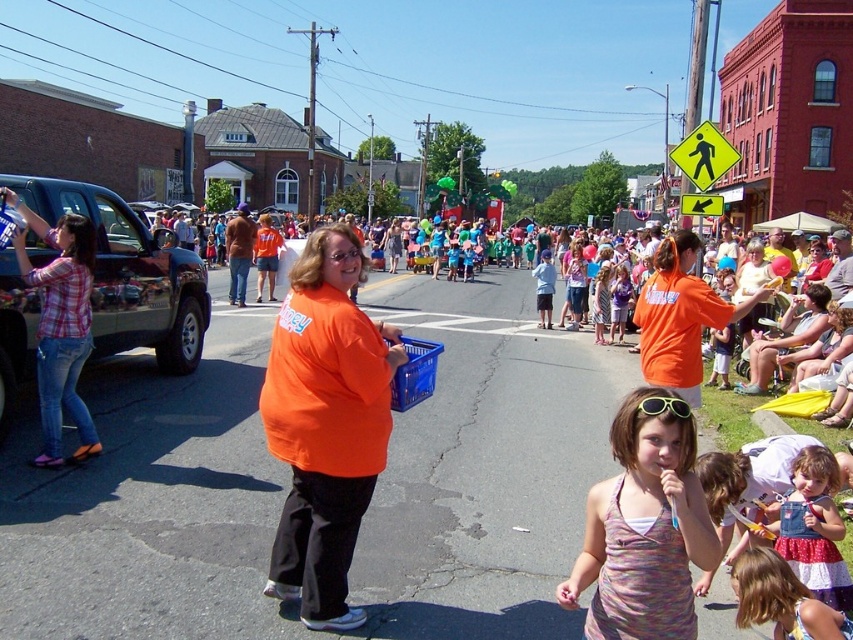
Who is lower down, orange fabric shirt at center or sunglasses at center?

orange fabric shirt at center

Between point (347, 435) and point (682, 404), which one is positioned in front?

Point (682, 404) is in front.

Between point (314, 365) and point (656, 401), which one is positioned in front?

Point (656, 401)

You are a GUI agent. You are given a task and a screenshot of the screen. Output one action in this format:
    pyautogui.click(x=<x>, y=<y>)
    Task: Click on the orange fabric shirt at center
    
    Given the screenshot: What is the action you would take?
    pyautogui.click(x=325, y=424)

Is printed cotton tank top at center positioned behind orange matte shirt at center?

No, it is not.

Is printed cotton tank top at center positioned before orange matte shirt at center?

Yes, printed cotton tank top at center is in front of orange matte shirt at center.

Which is behind, point (660, 388) or point (735, 317)?

The point (735, 317) is behind.

I want to click on printed cotton tank top at center, so click(643, 531).

Can you confirm if pastel striped dress at lower right is wider than sunglasses at center?

Yes.

Is pastel striped dress at lower right taller than sunglasses at center?

Yes, pastel striped dress at lower right is taller than sunglasses at center.

Describe the element at coordinates (781, 600) in the screenshot. This screenshot has height=640, width=853. I see `pastel striped dress at lower right` at that location.

The image size is (853, 640). Identify the location of pastel striped dress at lower right. (781, 600).